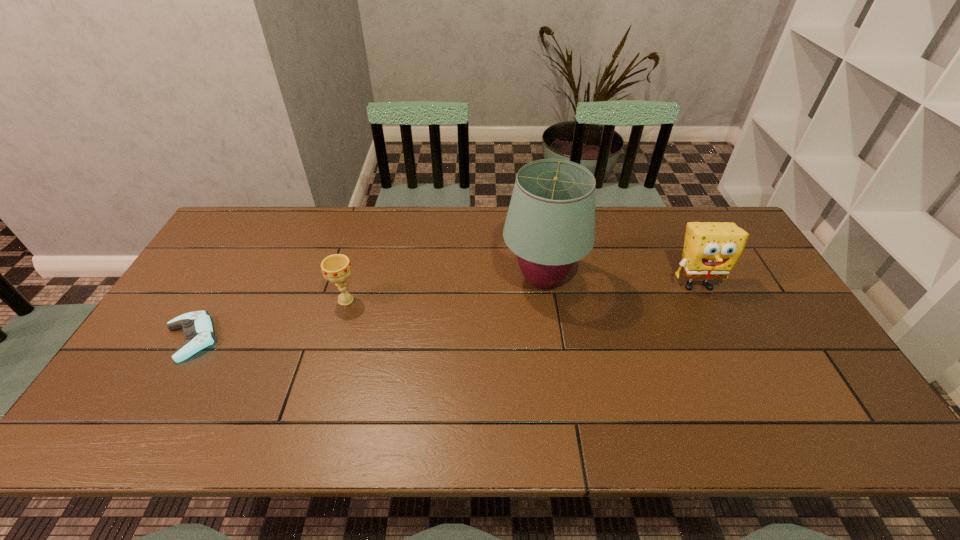
You are a GUI agent. You are given a task and a screenshot of the screen. Output one action in this format:
    pyautogui.click(x=<x>, y=<y>)
    Task: Click on the object that is the third closest to the third object from left to right
    The height and width of the screenshot is (540, 960).
    Given the screenshot: What is the action you would take?
    pyautogui.click(x=198, y=330)

The image size is (960, 540). In order to click on vacant space that satisfies the following two spatial constraints: 1. on the back side of the third object from right to left; 2. on the right side of the third object from left to right in this screenshot , I will do `click(352, 280)`.

You are a GUI agent. You are given a task and a screenshot of the screen. Output one action in this format:
    pyautogui.click(x=<x>, y=<y>)
    Task: Click on the free point that satisfies the following two spatial constraints: 1. on the back side of the leftmost object; 2. on the left side of the third object from left to right
    This screenshot has width=960, height=540.
    Given the screenshot: What is the action you would take?
    pyautogui.click(x=227, y=280)

What are the coordinates of `free location that satisfies the following two spatial constraints: 1. on the back side of the second shortest object; 2. on the right side of the shortest object` in the screenshot? It's located at (214, 300).

This screenshot has height=540, width=960. What are the coordinates of `vacant area that satisfies the following two spatial constraints: 1. on the back side of the control; 2. on the left side of the second shortest object` in the screenshot? It's located at (214, 300).